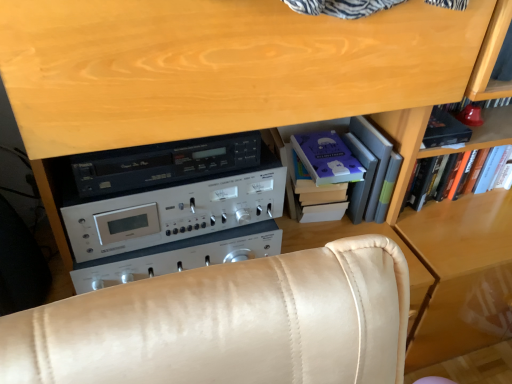
Question: Is silver metallic stereo at center to the left or to the right of wooden bookshelf at right, the 2th shelf positioned from the left, in the image?

Choices:
 (A) right
 (B) left

Answer: (B)

Question: From the image's perspective, relative to wooden bookshelf at right, which is counted as the 1th shelf, starting from the right, is silver metallic stereo at center above or below?

Choices:
 (A) below
 (B) above

Answer: (A)

Question: Estimate the real-world distances between objects in this image. Which object is farther from the wooden bookshelf at right, the 2th shelf positioned from the left?

Choices:
 (A) hardcover book at upper right
 (B) silver metallic stereo at center
 (C) purple matte paper at center, the second paperback book in the right-to-left sequence
 (D) matte purple paperback book at upper right, arranged as the second paperback book when viewed from the left
 (E) hardcover books at center, arranged as the 1th shelf when viewed from the left

Answer: (B)

Question: Considering the real-world distances, which object is closest to the matte purple paperback book at upper right, the 1th paperback book in the right-to-left sequence?

Choices:
 (A) hardcover books at center, which is counted as the second shelf, starting from the right
 (B) purple matte paper at center, arranged as the first paperback book when viewed from the left
 (C) silver metallic stereo at center
 (D) hardcover book at upper right
 (E) wooden bookshelf at right, the 2th shelf positioned from the left

Answer: (E)